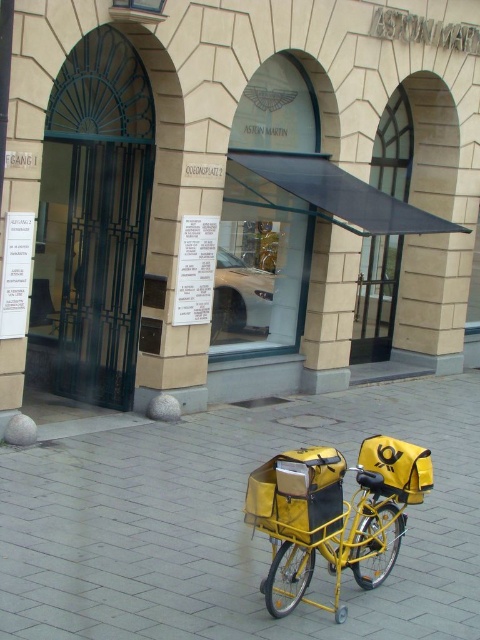
You are standing at the camera position and want to place a 5 meter long banner from your current position to the yellow matte pavement at lower center. Is the distance sufficient?

The distance between the camera and the yellow matte pavement at lower center is 4.45 meters. Since the banner is 5 meters long, it is longer than the available space, so the banner cannot be fully placed from the camera to the yellow matte pavement at lower center.

From the picture: You are standing at the entrance of the Aston Martin building and want to park your car. The parking spot is marked by the point at coordinates [229,524]. Where exactly is this parking spot located?

The point at coordinates [229,524] marks the yellow matte pavement at lower center, so the parking spot is located on the yellow matte pavement at lower center.

You are standing at the entrance of the Aston Martin dealership and want to walk to a specific location marked by point [291,572]. There is a yellow bicycle with two mail bags parked at point [167,602]. Will the bicycle block your path to the target point?

Point [167,602] is in front of point [291,572], so the bicycle parked at point [167,602] will block your path to the target point [291,572].